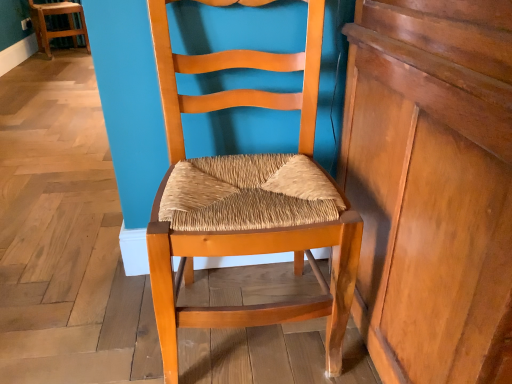
I want to click on vacant space in wooden chair at upper left, the 1th chair in the back-to-front sequence (from a real-world perspective), so click(x=61, y=55).